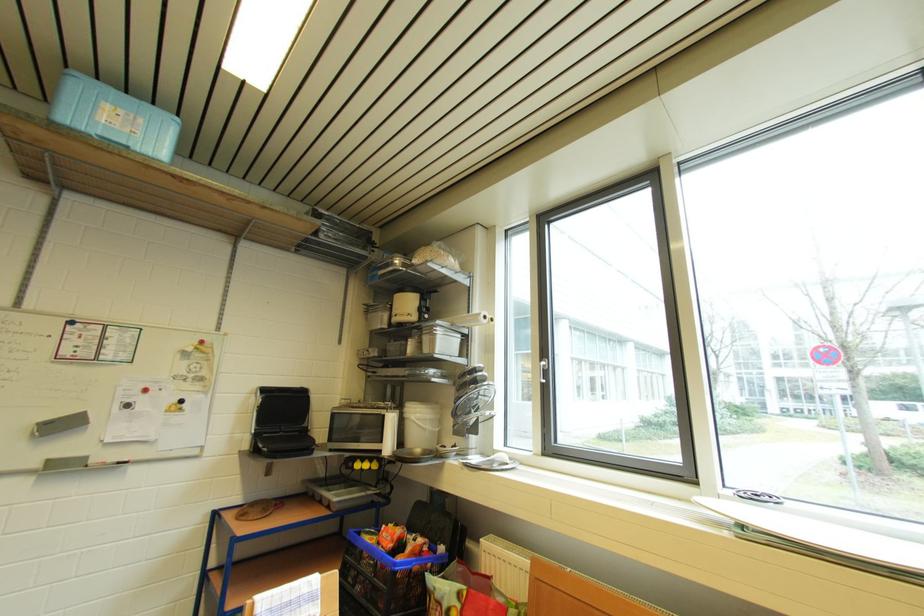
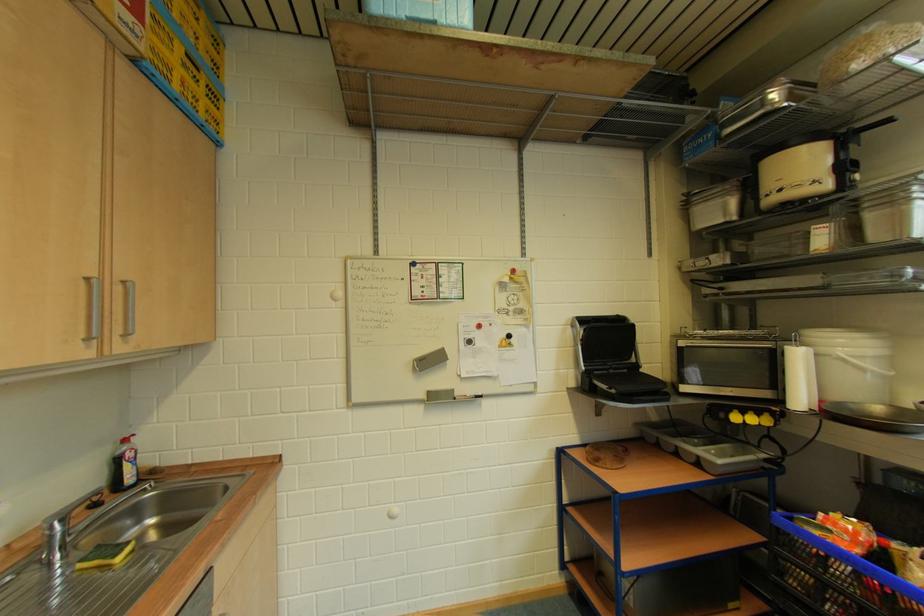
Locate, in the second image, the point that corresponds to [357,586] in the first image.

(803, 591)